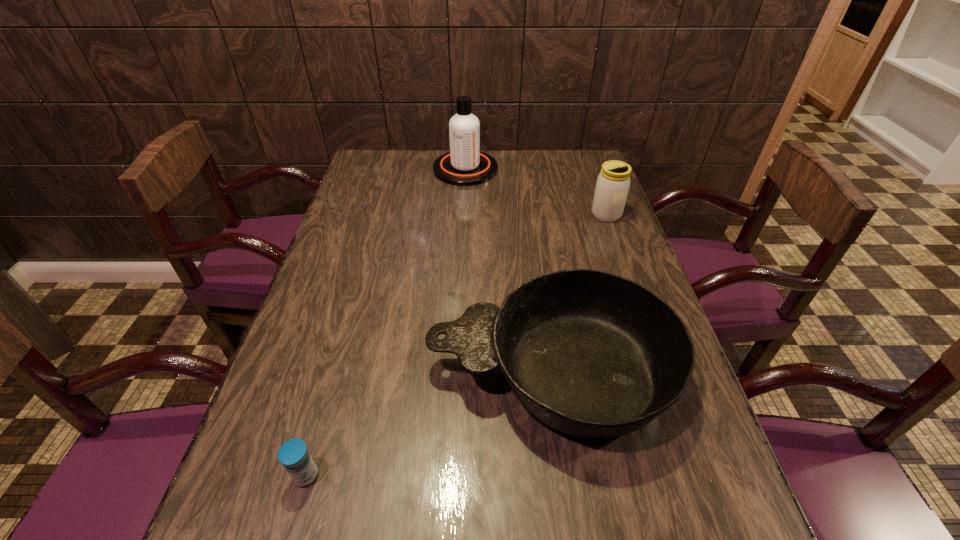
This screenshot has height=540, width=960. I want to click on vacant point located between the second farthest object and the cleansing agent, so pos(536,192).

Locate which object ranks in proximity to the nearest object. Please provide its 2D coordinates. Your answer should be formatted as a tuple, i.e. [(x, y)], where the tuple contains the x and y coordinates of a point satisfying the conditions above.

[(591, 354)]

Locate which object is the second closest to the farthest object. Please provide its 2D coordinates. Your answer should be formatted as a tuple, i.e. [(x, y)], where the tuple contains the x and y coordinates of a point satisfying the conditions above.

[(591, 354)]

You are a GUI agent. You are given a task and a screenshot of the screen. Output one action in this format:
    pyautogui.click(x=<x>, y=<y>)
    Task: Click on the free space that satisfies the following two spatial constraints: 1. on the front side of the third nearest object; 2. on the left side of the cleansing agent
    This screenshot has width=960, height=540.
    Given the screenshot: What is the action you would take?
    pyautogui.click(x=464, y=214)

Find the location of a particular element. This screenshot has width=960, height=540. free space that satisfies the following two spatial constraints: 1. with the handle extending from the side of the second nearest object; 2. on the right side of the third nearest object is located at coordinates (528, 214).

Identify the location of vacant space that satisfies the following two spatial constraints: 1. on the front side of the second tallest object; 2. on the left side of the farthest object. pyautogui.click(x=464, y=214).

Identify the location of free space in the image that satisfies the following two spatial constraints: 1. with the handle extending from the side of the third shortest object; 2. on the left side of the frying pan. (528, 214).